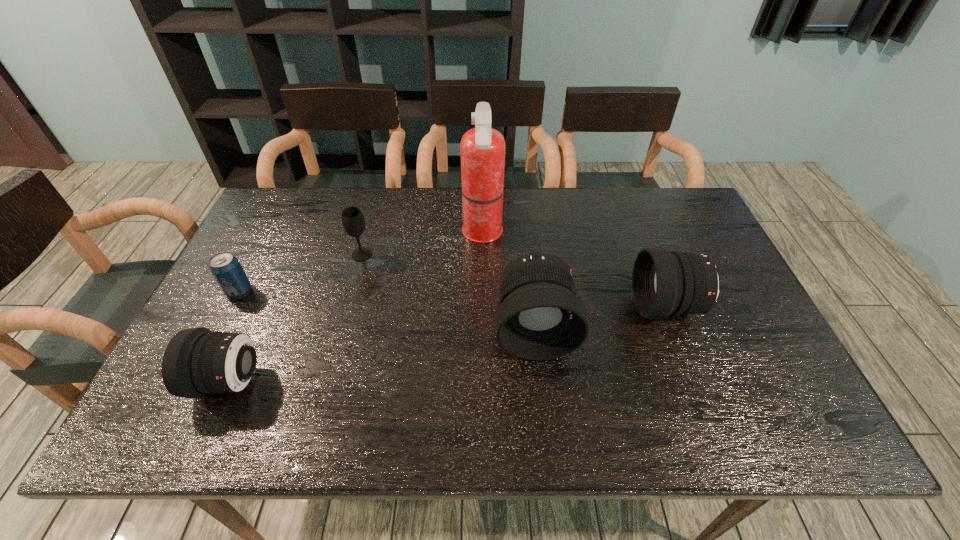
At what (x,y) coordinates should I click in order to perform the action: click on vacant position located 0.320m at the front element of the rightmost object. Please return your answer as a coordinate pair (x, y). The image size is (960, 540). Looking at the image, I should click on (513, 307).

This screenshot has width=960, height=540. What are the coordinates of `free space located 0.100m at the front element of the rightmost object` in the screenshot? It's located at (596, 307).

Identify the location of vacant space located 0.090m at the front element of the rightmost object. The width and height of the screenshot is (960, 540). (600, 307).

Where is `blank space located 0.380m with the handle and hose on the tallest object`? blank space located 0.380m with the handle and hose on the tallest object is located at coordinates (338, 234).

Find the location of a particular element. The image size is (960, 540). free spot located with the handle and hose on the tallest object is located at coordinates pyautogui.click(x=410, y=234).

This screenshot has width=960, height=540. I want to click on vacant space positioned 0.240m with the handle and hose on the tallest object, so click(x=384, y=234).

I want to click on free space located 0.280m on the back of the shortest object, so pyautogui.click(x=276, y=218).

The height and width of the screenshot is (540, 960). Find the location of `vacant space located on the right of the wineglass`. vacant space located on the right of the wineglass is located at coordinates (447, 254).

Find the location of `object positioned at the far edge`. object positioned at the far edge is located at coordinates (482, 148).

At what (x,y) coordinates should I click in order to perform the action: click on object situated at the near edge. Please return your answer as a coordinate pair (x, y). Image resolution: width=960 pixels, height=540 pixels. Looking at the image, I should click on (197, 361).